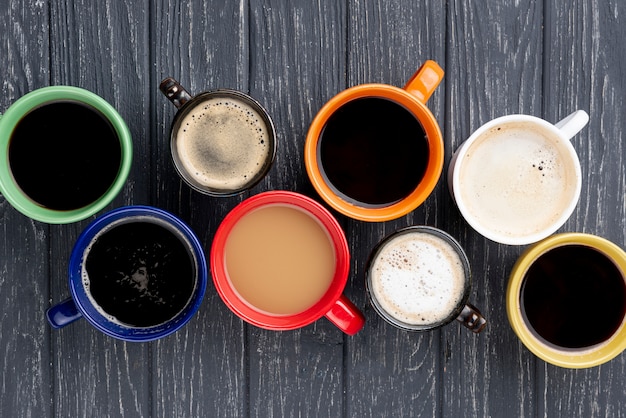
At what (x,y) coordinates should I click in order to perform the action: click on mug. Please return your answer as a coordinate pair (x, y). This screenshot has height=418, width=626. Looking at the image, I should click on (79, 153), (154, 287), (220, 150), (285, 253), (392, 166), (416, 283), (509, 183), (562, 313).